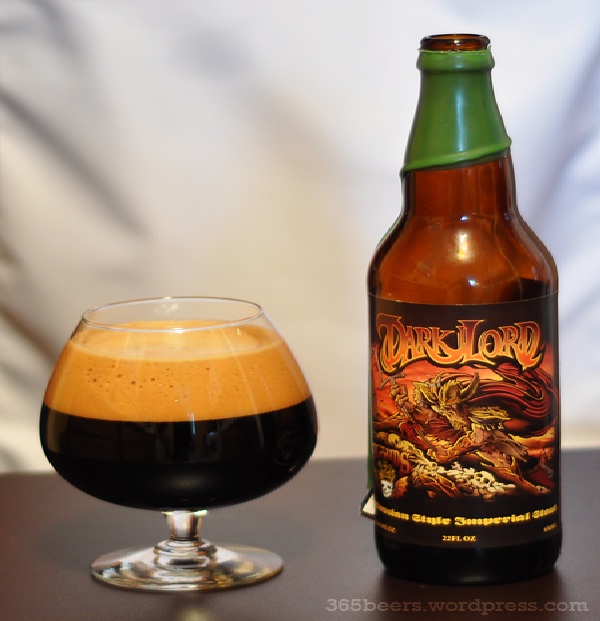
Locate an element on the screen. base of glass is located at coordinates (191, 574).